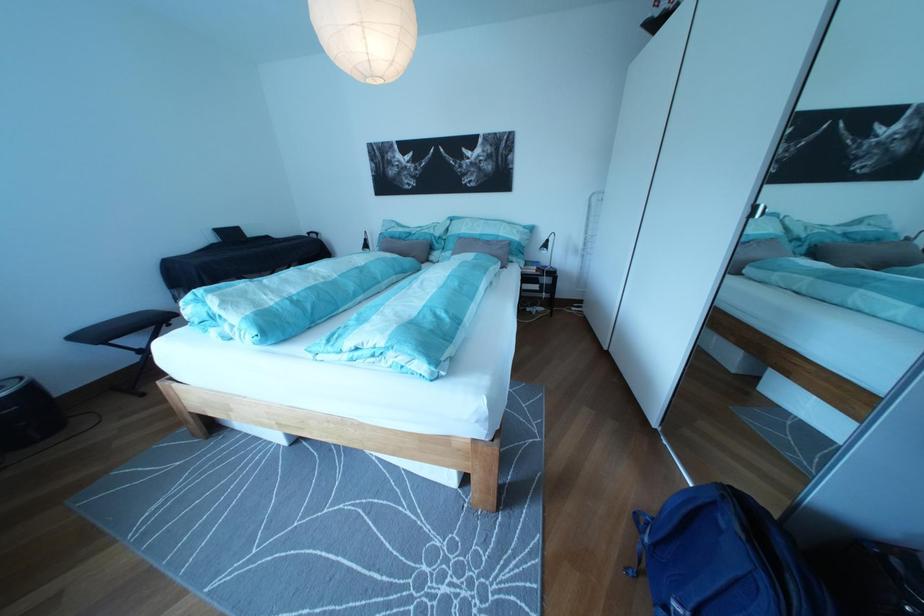
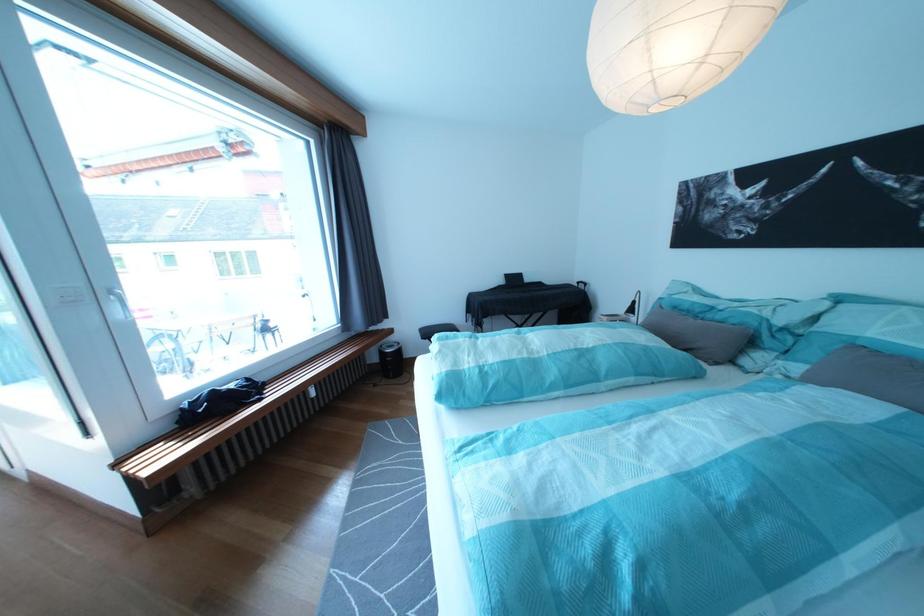
Where in the second image is the point corresponding to pixel 286 310 from the first image?

(480, 373)